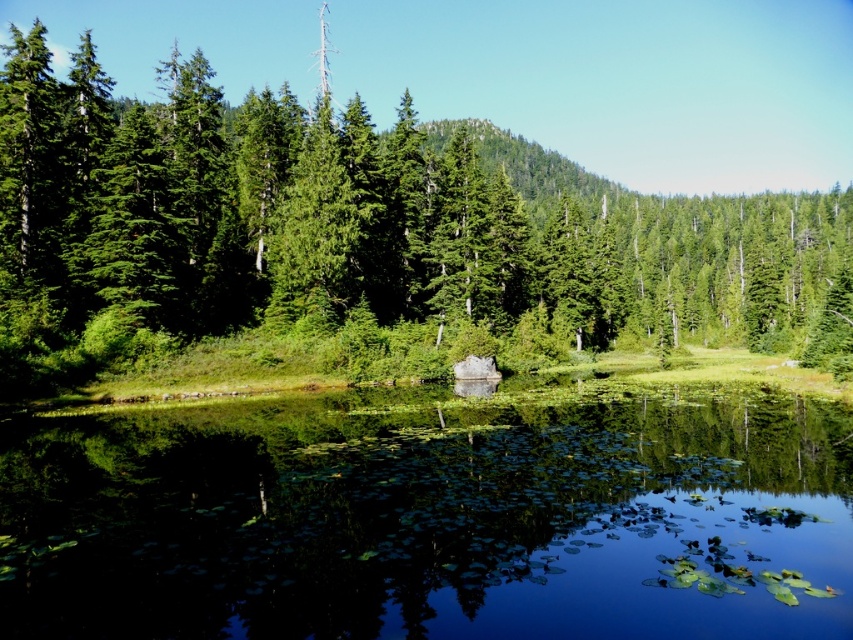
Which is more to the left, green reflective water at center or green matte tree at center?

Positioned to the left is green reflective water at center.

Is green reflective water at center behind green matte tree at center?

No, green reflective water at center is in front of green matte tree at center.

Does point (227, 602) come closer to viewer compared to point (120, 241)?

That is True.

Find the location of `green reflective water at center`. green reflective water at center is located at coordinates (428, 520).